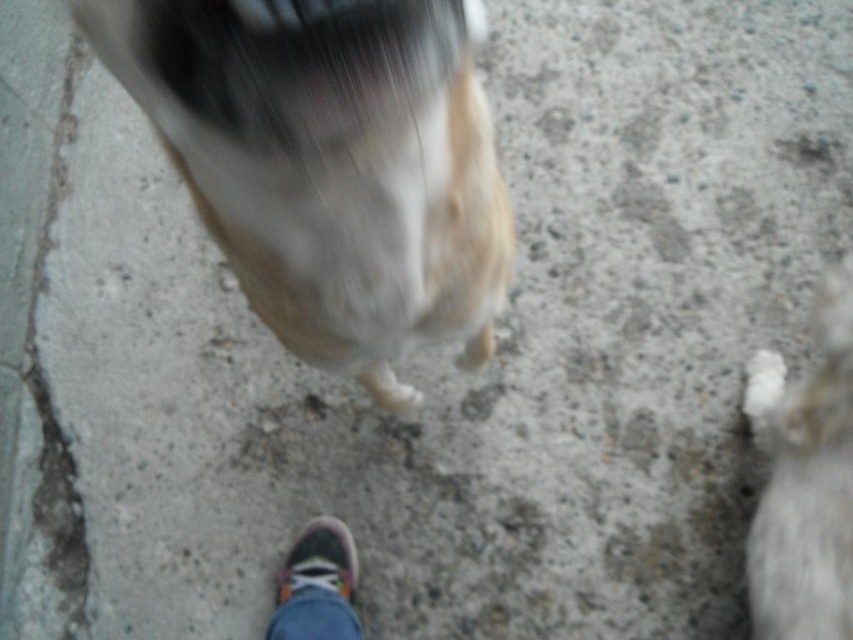
You are standing on a concrete surface and see two white fluffy dogs in the image. Which dog is positioned higher up, the fluffy white dog at center or the white fluffy dog at lower right?

The fluffy white dog at center is positioned higher up than the white fluffy dog at lower right because it is described as being above the other dog.

Based on the photo, you are standing on the concrete surface and see two dogs. Which one is closer to your right side, the fluffy white dog at center or the white fluffy dog at lower right?

The white fluffy dog at lower right is closer to your right side because it is positioned to the right of the fluffy white dog at center.